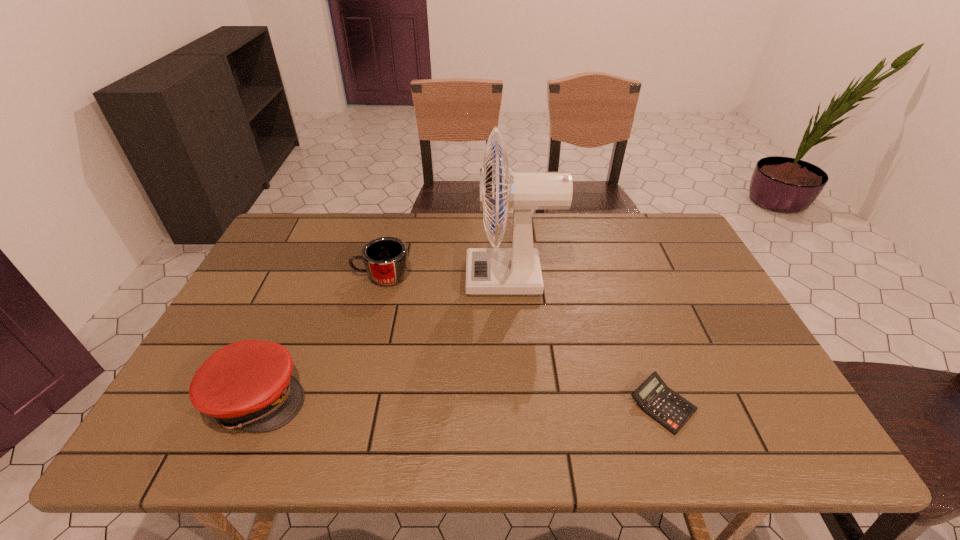
Locate an element on the screen. The height and width of the screenshot is (540, 960). free space that satisfies the following two spatial constraints: 1. on the front of the shortest object with an emblem; 2. on the left side of the cap is located at coordinates (254, 405).

Identify the location of free space that satisfies the following two spatial constraints: 1. on the front of the rightmost object with an emblem; 2. on the right side of the cap. (254, 405).

Locate an element on the screen. This screenshot has height=540, width=960. vacant space that satisfies the following two spatial constraints: 1. on the front of the leftmost object with an emblem; 2. on the back side of the rightmost object is located at coordinates 254,405.

Where is `vacant region that satisfies the following two spatial constraints: 1. on the side of the second object from left to right with the handle; 2. on the right side of the calculator`? vacant region that satisfies the following two spatial constraints: 1. on the side of the second object from left to right with the handle; 2. on the right side of the calculator is located at coordinates (348, 405).

Where is `free region that satisfies the following two spatial constraints: 1. on the front of the rightmost object with an emblem; 2. on the left side of the cap`? The height and width of the screenshot is (540, 960). free region that satisfies the following two spatial constraints: 1. on the front of the rightmost object with an emblem; 2. on the left side of the cap is located at coordinates (254, 405).